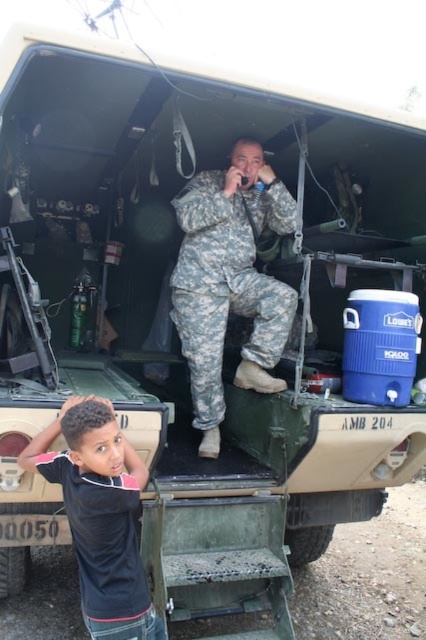
Between camouflage fabric uniform at center and black matte shirt at lower left, which one has less height?

black matte shirt at lower left

Can you confirm if camouflage fabric uniform at center is wider than black matte shirt at lower left?

Correct, the width of camouflage fabric uniform at center exceeds that of black matte shirt at lower left.

Between point (239, 259) and point (106, 554), which one is positioned in front?

Positioned in front is point (106, 554).

I want to click on camouflage fabric uniform at center, so click(x=230, y=282).